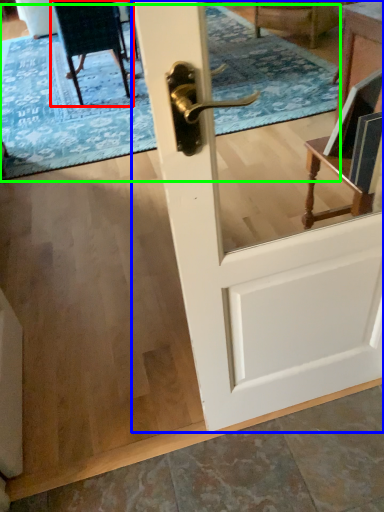
Question: Which object is positioned farthest from chair (highlighted by a red box)? Select from door (highlighted by a blue box) and doormat (highlighted by a green box).

Choices:
 (A) door
 (B) doormat

Answer: (A)